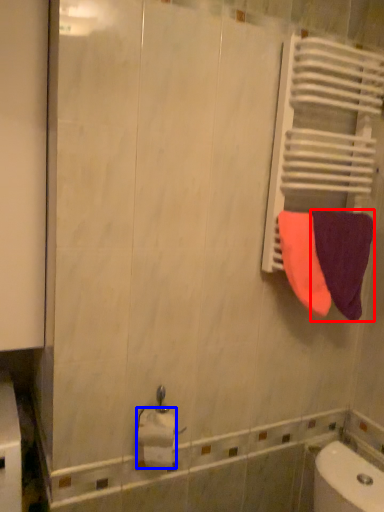
Question: Among these objects, which one is farthest to the camera, towel (highlighted by a red box) or toilet paper (highlighted by a blue box)?

Choices:
 (A) towel
 (B) toilet paper

Answer: (A)